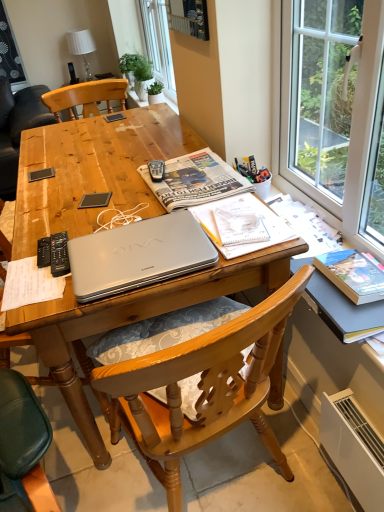
In order to face black plastic remote control at left, which is counted as the second remote control, starting from the right, should I rotate leftwards or rightwards?

It's best to rotate left around 19.389 degrees.

Image resolution: width=384 pixels, height=512 pixels. Describe the element at coordinates (59, 254) in the screenshot. I see `black plastic remote control at left, which is counted as the first remote control, starting from the right` at that location.

What is the approximate height of white fabric lampshade at upper center?

white fabric lampshade at upper center is 17.02 inches in height.

The height and width of the screenshot is (512, 384). What do you see at coordinates (92, 170) in the screenshot?
I see `wooden table at center` at bounding box center [92, 170].

The image size is (384, 512). What do you see at coordinates (195, 180) in the screenshot?
I see `silver metallic laptop at center` at bounding box center [195, 180].

This screenshot has height=512, width=384. In order to click on silver metallic laptop at center in this screenshot , I will do `click(138, 255)`.

The height and width of the screenshot is (512, 384). What are the coordinates of `black plastic remote control at left, which is counted as the second remote control, starting from the right` in the screenshot? It's located at (44, 252).

There is a silver metallic laptop at center. Identify the location of the 2nd remote control below it (from the image's perspective). (44, 252).

Is silver metallic laptop at center spatially inside black plastic remote control at left, which is counted as the first remote control, starting from the left, or outside of it?

silver metallic laptop at center is spatially situated outside black plastic remote control at left, which is counted as the first remote control, starting from the left.

Which is behind, point (136, 288) or point (44, 243)?

Point (44, 243)

Could silver metallic laptop at center be considered to be inside black plastic remote control at left, which is counted as the second remote control, starting from the right?

No.

Which point is more forward, [39,264] or [183,186]?

The point [39,264] is in front.

From a real-world perspective, which is physically below, black plastic remote control at left, which is counted as the second remote control, starting from the right, or silver metallic laptop at center?

silver metallic laptop at center is physically lower.

Considering the positions of objects black plastic remote control at left, which is counted as the second remote control, starting from the right, and silver metallic laptop at center in the image provided, who is more to the left, black plastic remote control at left, which is counted as the second remote control, starting from the right, or silver metallic laptop at center?

black plastic remote control at left, which is counted as the second remote control, starting from the right.

Is point (205, 234) closer or farther from the camera than point (78, 35)?

Point (205, 234).

Consider the image. Is silver metallic laptop at center taller than white fabric lampshade at upper center?

Incorrect, the height of silver metallic laptop at center is not larger of that of white fabric lampshade at upper center.

Is silver metallic laptop at center bigger than white fabric lampshade at upper center?

No, silver metallic laptop at center is not bigger than white fabric lampshade at upper center.

Is silver metallic laptop at center shorter than black plastic remote control at left, which is counted as the second remote control, starting from the right?

In fact, silver metallic laptop at center may be taller than black plastic remote control at left, which is counted as the second remote control, starting from the right.

Which of these two, silver metallic laptop at center or black plastic remote control at left, which is counted as the first remote control, starting from the left, is bigger?

silver metallic laptop at center is bigger.

Could you tell me if silver metallic laptop at center is facing black plastic remote control at left, which is counted as the first remote control, starting from the left?

Yes, silver metallic laptop at center faces towards black plastic remote control at left, which is counted as the first remote control, starting from the left.

From a real-world perspective, is silver metallic laptop at center positioned over black plastic remote control at left, which is counted as the first remote control, starting from the left, based on gravity?

Actually, silver metallic laptop at center is physically below black plastic remote control at left, which is counted as the first remote control, starting from the left, in the real world.

Does white fabric lampshade at upper center turn towards silver metallic laptop at center?

Yes, white fabric lampshade at upper center is aimed at silver metallic laptop at center.

Can you confirm if white fabric lampshade at upper center is smaller than silver metallic laptop at center?

Actually, white fabric lampshade at upper center might be larger than silver metallic laptop at center.

From the image's perspective, between white fabric lampshade at upper center and silver metallic laptop at center, which one is located above?

white fabric lampshade at upper center appears higher in the image.

Consider the image. Which is more to the left, white fabric lampshade at upper center or silver metallic laptop at center?

From the viewer's perspective, white fabric lampshade at upper center appears more on the left side.

Find the location of a particular element. laptop below the silver metallic laptop at center (from the image's perspective) is located at coordinates (138, 255).

Is silver metallic laptop at center thinner than silver metallic laptop at center?

Incorrect, the width of silver metallic laptop at center is not less than that of silver metallic laptop at center.

From the image's perspective, which one is positioned lower, silver metallic laptop at center or silver metallic laptop at center?

silver metallic laptop at center, from the image's perspective.

Is wooden table at center inside the boundaries of white fabric lampshade at upper center, or outside?

wooden table at center is not inside white fabric lampshade at upper center, it's outside.

Is the surface of wooden table at center in direct contact with white fabric lampshade at upper center?

No, wooden table at center is not with white fabric lampshade at upper center.

Is wooden table at center turned away from white fabric lampshade at upper center?

wooden table at center does not have its back to white fabric lampshade at upper center.

From a real-world perspective, is wooden table at center positioned over white fabric lampshade at upper center based on gravity?

No, from a real-world perspective, wooden table at center is not over white fabric lampshade at upper center

Locate an element on the screen. The image size is (384, 512). laptop that is on the right side of black plastic remote control at left, which is counted as the second remote control, starting from the right is located at coordinates (138, 255).

From a real-world perspective, starting from the silver metallic laptop at center, which remote control is the 1st one vertically above it? Please provide its 2D coordinates.

[(44, 252)]

From the image, which object appears to be farther from silver metallic laptop at center, black plastic remote control at left, which is counted as the first remote control, starting from the right, or wooden table at center?

black plastic remote control at left, which is counted as the first remote control, starting from the right.

Considering their positions, is black plastic remote control at left, which is counted as the second remote control, starting from the right, positioned further to white fabric lampshade at upper center than wooden table at center?

Based on the image, black plastic remote control at left, which is counted as the second remote control, starting from the right, appears to be further to white fabric lampshade at upper center.

Based on their spatial positions, is silver metallic laptop at center or wooden table at center further from white fabric lampshade at upper center?

silver metallic laptop at center is positioned further to the anchor white fabric lampshade at upper center.

Considering their positions, is black plastic remote control at left, which is counted as the first remote control, starting from the left, positioned closer to silver metallic laptop at center than wooden table at center?

The object closer to silver metallic laptop at center is wooden table at center.

Based on their spatial positions, is silver metallic laptop at center or black plastic remote control at left, which is counted as the first remote control, starting from the left, further from white fabric lampshade at upper center?

black plastic remote control at left, which is counted as the first remote control, starting from the left, lies further to white fabric lampshade at upper center than the other object.

From the image, which object appears to be farther from wooden table at center, black plastic remote control at left, which is counted as the second remote control, starting from the right, or silver metallic laptop at center?

Among the two, black plastic remote control at left, which is counted as the second remote control, starting from the right, is located further to wooden table at center.

From the image, which object appears to be farther from silver metallic laptop at center, silver metallic laptop at center or white fabric lampshade at upper center?

white fabric lampshade at upper center is positioned further to the anchor silver metallic laptop at center.

Which object lies further to the anchor point silver metallic laptop at center, silver metallic laptop at center or black plastic remote control at left, positioned as the 2th remote control in left-to-right order?

Based on the image, silver metallic laptop at center appears to be further to silver metallic laptop at center.

You are a GUI agent. You are given a task and a screenshot of the screen. Output one action in this format:
    pyautogui.click(x=<x>, y=<y>)
    Task: Click on the laptop between black plastic remote control at left, which is counted as the second remote control, starting from the right, and silver metallic laptop at center, in the horizontal direction
    The height and width of the screenshot is (512, 384).
    Given the screenshot: What is the action you would take?
    pyautogui.click(x=138, y=255)

Where is `magazine positioned between silver metallic laptop at center and white fabric lampshade at upper center from near to far`? magazine positioned between silver metallic laptop at center and white fabric lampshade at upper center from near to far is located at coordinates (195, 180).

You are a GUI agent. You are given a task and a screenshot of the screen. Output one action in this format:
    pyautogui.click(x=<x>, y=<y>)
    Task: Click on the remote control between black plastic remote control at left, which is counted as the second remote control, starting from the right, and silver metallic laptop at center
    
    Given the screenshot: What is the action you would take?
    pyautogui.click(x=59, y=254)

Locate an element on the screen. The width and height of the screenshot is (384, 512). desk between black plastic remote control at left, which is counted as the first remote control, starting from the left, and silver metallic laptop at center is located at coordinates (92, 170).